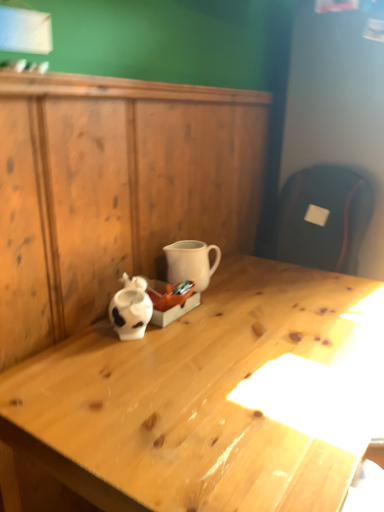
The height and width of the screenshot is (512, 384). In order to click on vacant space in front of white matte coffee cup at center in this screenshot , I will do `click(210, 310)`.